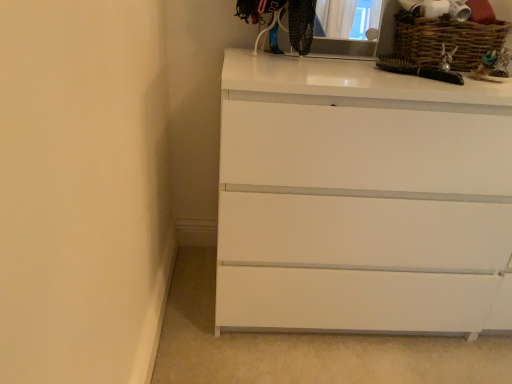
What do you see at coordinates (360, 198) in the screenshot? I see `white glossy chest of drawers at center` at bounding box center [360, 198].

Measure the distance between matte black medicine cabinet at upper center and camera.

matte black medicine cabinet at upper center and camera are 1.20 meters apart.

The height and width of the screenshot is (384, 512). I want to click on white glossy chest of drawers at center, so click(360, 198).

From a real-world perspective, which is physically below, matte black medicine cabinet at upper center or woven brown basket at upper right?

woven brown basket at upper right.

Between matte black medicine cabinet at upper center and woven brown basket at upper right, which one appears on the left side from the viewer's perspective?

Positioned to the left is matte black medicine cabinet at upper center.

Relative to woven brown basket at upper right, is matte black medicine cabinet at upper center in front or behind?

Clearly, matte black medicine cabinet at upper center is in front of woven brown basket at upper right.

At what (x,y) coordinates should I click in order to perform the action: click on medicine cabinet above the woven brown basket at upper right (from a real-world perspective). Please return your answer as a coordinate pair (x, y). This screenshot has width=512, height=384. Looking at the image, I should click on (347, 47).

Which object is more forward, woven brown basket at upper right or matte black medicine cabinet at upper center?

matte black medicine cabinet at upper center.

Does woven brown basket at upper right have a larger size compared to matte black medicine cabinet at upper center?

Correct, woven brown basket at upper right is larger in size than matte black medicine cabinet at upper center.

Does point (447, 32) appear closer or farther from the camera than point (392, 8)?

Clearly, point (447, 32) is closer to the camera than point (392, 8).

Are white glossy chest of drawers at center and woven brown basket at upper right far apart?

No.

Based on their positions, is white glossy chest of drawers at center located to the left or right of woven brown basket at upper right?

white glossy chest of drawers at center is positioned on woven brown basket at upper right's left side.

How many degrees apart are the facing directions of white glossy chest of drawers at center and woven brown basket at upper right?

They differ by 3.72 degrees in their facing directions.

Image resolution: width=512 pixels, height=384 pixels. In order to click on the chest of drawers that is below the matte black medicine cabinet at upper center (from the image's perspective) in this screenshot , I will do `click(360, 198)`.

Are white glossy chest of drawers at center and matte black medicine cabinet at upper center far apart?

No, white glossy chest of drawers at center is not far from matte black medicine cabinet at upper center.

Considering the sizes of objects white glossy chest of drawers at center and matte black medicine cabinet at upper center in the image provided, who is wider, white glossy chest of drawers at center or matte black medicine cabinet at upper center?

With larger width is white glossy chest of drawers at center.

Is white glossy chest of drawers at center looking in the opposite direction of matte black medicine cabinet at upper center?

That's not correct — white glossy chest of drawers at center is not looking away from matte black medicine cabinet at upper center.

Is matte black medicine cabinet at upper center inside or outside of white glossy chest of drawers at center?

matte black medicine cabinet at upper center is outside white glossy chest of drawers at center.

In terms of width, does matte black medicine cabinet at upper center look wider or thinner when compared to white glossy chest of drawers at center?

matte black medicine cabinet at upper center is thinner than white glossy chest of drawers at center.

How far apart are matte black medicine cabinet at upper center and white glossy chest of drawers at center?

The distance of matte black medicine cabinet at upper center from white glossy chest of drawers at center is 53.67 centimeters.

Are matte black medicine cabinet at upper center and white glossy chest of drawers at center beside each other?

No, matte black medicine cabinet at upper center is not beside white glossy chest of drawers at center.

Can you tell me how much woven brown basket at upper right and white glossy chest of drawers at center differ in facing direction?

The angle between the facing direction of woven brown basket at upper right and the facing direction of white glossy chest of drawers at center is 3.72 degrees.

Which of these two, woven brown basket at upper right or white glossy chest of drawers at center, is smaller?

woven brown basket at upper right is smaller.

From the image's perspective, is woven brown basket at upper right positioned above or below white glossy chest of drawers at center?

From the image's perspective, woven brown basket at upper right appears above white glossy chest of drawers at center.

From a real-world perspective, is woven brown basket at upper right beneath white glossy chest of drawers at center?

Actually, woven brown basket at upper right is physically above white glossy chest of drawers at center in the real world.

I want to click on medicine cabinet located in front of the woven brown basket at upper right, so click(x=347, y=47).

In order to click on basket located behind the matte black medicine cabinet at upper center in this screenshot , I will do `click(446, 40)`.

From the image, which object appears to be farther from matte black medicine cabinet at upper center, woven brown basket at upper right or white glossy chest of drawers at center?

white glossy chest of drawers at center.

Considering their positions, is matte black medicine cabinet at upper center positioned closer to woven brown basket at upper right than white glossy chest of drawers at center?

Among the two, matte black medicine cabinet at upper center is located nearer to woven brown basket at upper right.

Looking at the image, which one is located closer to matte black medicine cabinet at upper center, white glossy chest of drawers at center or woven brown basket at upper right?

woven brown basket at upper right is closer to matte black medicine cabinet at upper center.

When comparing their distances from white glossy chest of drawers at center, does matte black medicine cabinet at upper center or woven brown basket at upper right seem further?

Among the two, matte black medicine cabinet at upper center is located further to white glossy chest of drawers at center.

Estimate the real-world distances between objects in this image. Which object is further from white glossy chest of drawers at center, woven brown basket at upper right or matte black medicine cabinet at upper center?

matte black medicine cabinet at upper center is further to white glossy chest of drawers at center.

From the image, which object appears to be nearer to woven brown basket at upper right, white glossy chest of drawers at center or matte black medicine cabinet at upper center?

matte black medicine cabinet at upper center is closer to woven brown basket at upper right.

This screenshot has height=384, width=512. What are the coordinates of `basket that lies between matte black medicine cabinet at upper center and white glossy chest of drawers at center from top to bottom` in the screenshot? It's located at (446, 40).